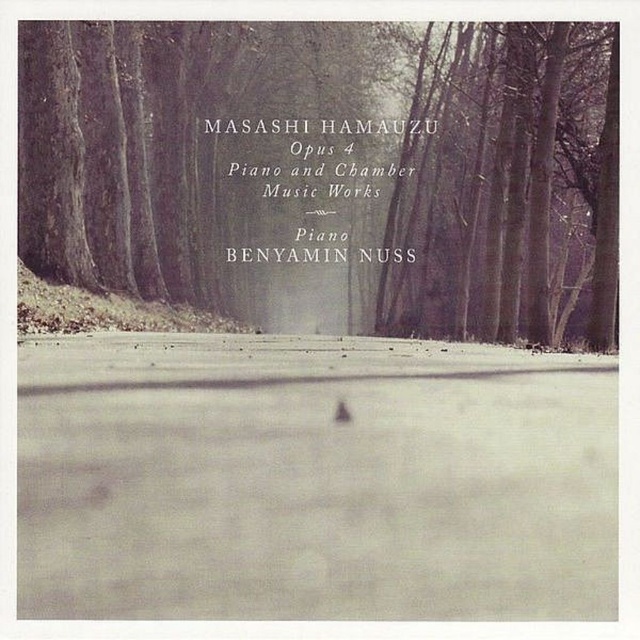
You are standing at the origin point in the image and want to walk towards the point labeled point (428, 248). However, there is an obstacle at point (428, 132). Will you encounter this obstacle before reaching your destination?

Yes, you will encounter the obstacle at point (428, 132) before reaching point (428, 248) because point (428, 248) is behind point (428, 132).